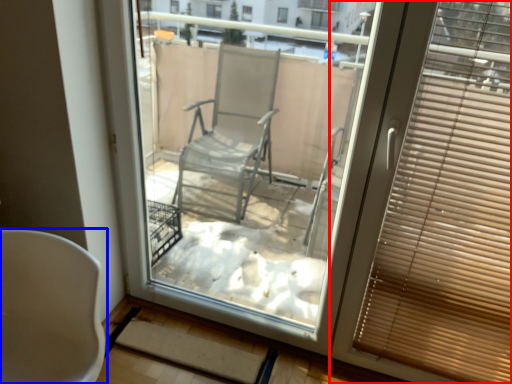
Question: Among these objects, which one is farthest to the camera, window blind (highlighted by a red box) or chair (highlighted by a blue box)?

Choices:
 (A) window blind
 (B) chair

Answer: (A)